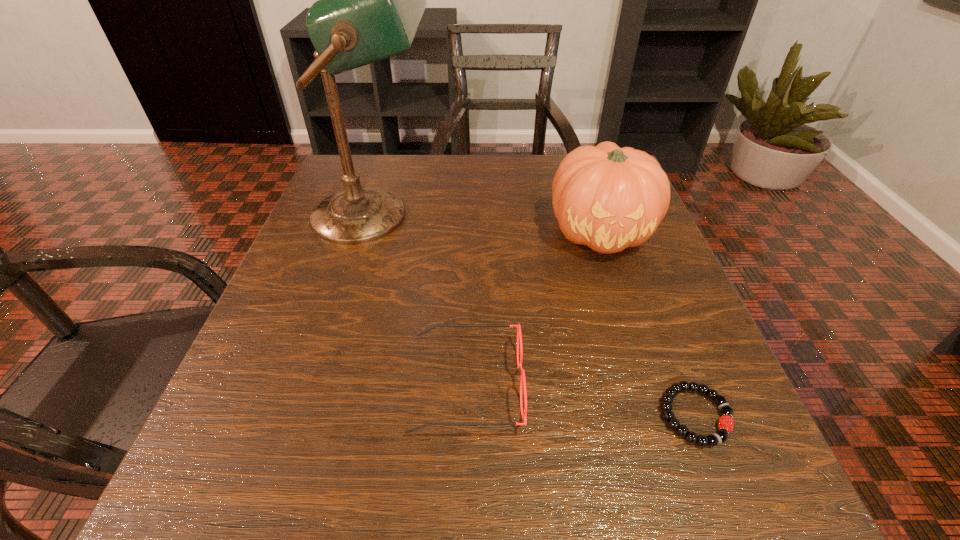
Where is `vacant area that lies between the spectacles and the bracelet`? The image size is (960, 540). vacant area that lies between the spectacles and the bracelet is located at coordinates (581, 400).

Find the location of a particular element. object that is the nearest to the shortest object is located at coordinates (522, 378).

Identify which object is located as the nearest to the pumpkin. Please provide its 2D coordinates. Your answer should be formatted as a tuple, i.e. [(x, y)], where the tuple contains the x and y coordinates of a point satisfying the conditions above.

[(522, 378)]

Locate an element on the screen. The height and width of the screenshot is (540, 960). free space that satisfies the following two spatial constraints: 1. on the front-facing side of the third tallest object; 2. on the back side of the shortest object is located at coordinates (466, 415).

Identify the location of vacant point that satisfies the following two spatial constraints: 1. on the carved face of the bracelet; 2. on the right side of the pumpkin. The width and height of the screenshot is (960, 540). (661, 415).

The height and width of the screenshot is (540, 960). In order to click on vacant area that satisfies the following two spatial constraints: 1. above the green lampshade of the table lamp; 2. on the back side of the shortest object in this screenshot , I will do `click(314, 415)`.

I want to click on vacant position in the image that satisfies the following two spatial constraints: 1. on the carved face of the pumpkin; 2. on the front-facing side of the spectacles, so click(x=651, y=384).

This screenshot has height=540, width=960. I want to click on free space that satisfies the following two spatial constraints: 1. on the front-facing side of the spectacles; 2. on the left side of the shortest object, so click(x=466, y=415).

Find the location of a particular element. The image size is (960, 540). free space that satisfies the following two spatial constraints: 1. on the front-facing side of the third tallest object; 2. on the back side of the bracelet is located at coordinates (466, 415).

Locate an element on the screen. The height and width of the screenshot is (540, 960). free location that satisfies the following two spatial constraints: 1. on the back side of the shortest object; 2. on the front-facing side of the third tallest object is located at coordinates (684, 384).